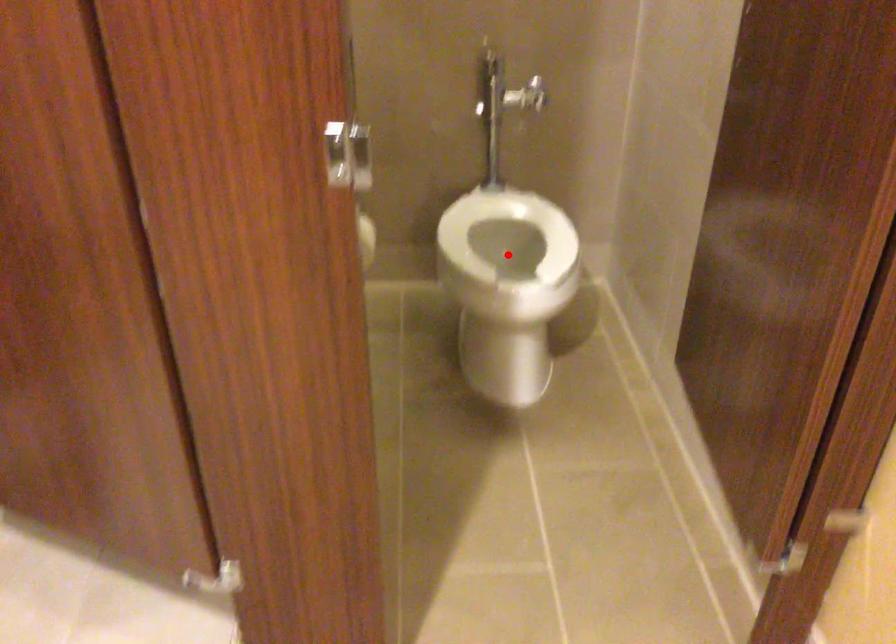
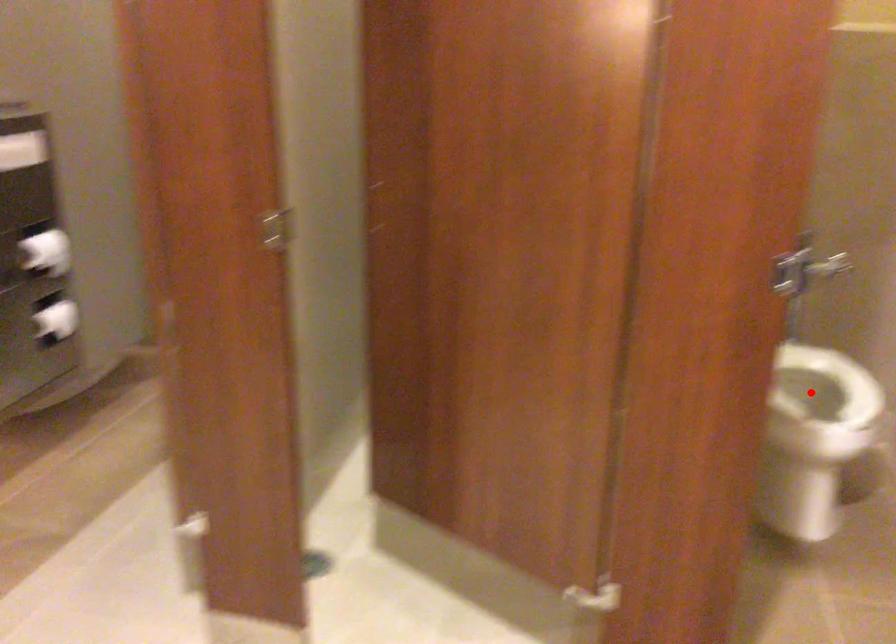
I am providing you with two images of the same scene from different viewpoints. A red point is marked on the first image and another point is marked on the second image. Does the point marked in image1 correspond to the same location as the one in image2?

Yes